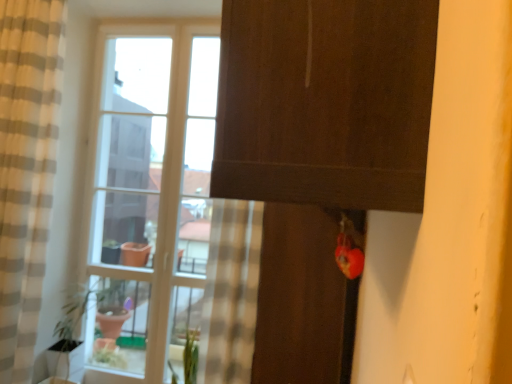
Question: Is clear glass window at center beside green matte plant at lower center?

Choices:
 (A) no
 (B) yes

Answer: (A)

Question: Does clear glass window at center have a greater width compared to green matte plant at lower center?

Choices:
 (A) no
 (B) yes

Answer: (A)

Question: From the image's perspective, does clear glass window at center appear lower than green matte plant at lower center?

Choices:
 (A) yes
 (B) no

Answer: (B)

Question: From the image's perspective, is clear glass window at center on green matte plant at lower center?

Choices:
 (A) yes
 (B) no

Answer: (A)

Question: Considering the relative sizes of clear glass window at center and green matte plant at lower center in the image provided, is clear glass window at center smaller than green matte plant at lower center?

Choices:
 (A) yes
 (B) no

Answer: (B)

Question: From their relative heights in the image, would you say beige striped curtain at left is taller or shorter than green matte plant at lower center?

Choices:
 (A) tall
 (B) short

Answer: (A)

Question: Is beige striped curtain at left to the left or to the right of green matte plant at lower center in the image?

Choices:
 (A) left
 (B) right

Answer: (A)

Question: Considering the positions of point (31, 319) and point (187, 350), is point (31, 319) closer or farther from the camera than point (187, 350)?

Choices:
 (A) closer
 (B) farther

Answer: (A)

Question: Is beige striped curtain at left bigger or smaller than green matte plant at lower center?

Choices:
 (A) big
 (B) small

Answer: (A)

Question: Which is correct: clear glass window at center is inside beige striped curtain at left, or outside of it?

Choices:
 (A) inside
 (B) outside

Answer: (B)

Question: Is clear glass window at center bigger or smaller than beige striped curtain at left?

Choices:
 (A) small
 (B) big

Answer: (A)

Question: From a real-world perspective, is clear glass window at center positioned above or below beige striped curtain at left?

Choices:
 (A) above
 (B) below

Answer: (B)

Question: In terms of width, does clear glass window at center look wider or thinner when compared to beige striped curtain at left?

Choices:
 (A) wide
 (B) thin

Answer: (B)

Question: In the image, is green matte plant at lower center on the left side or the right side of matte brown screen door at center?

Choices:
 (A) right
 (B) left

Answer: (B)

Question: From the image's perspective, relative to matte brown screen door at center, is green matte plant at lower center above or below?

Choices:
 (A) above
 (B) below

Answer: (B)